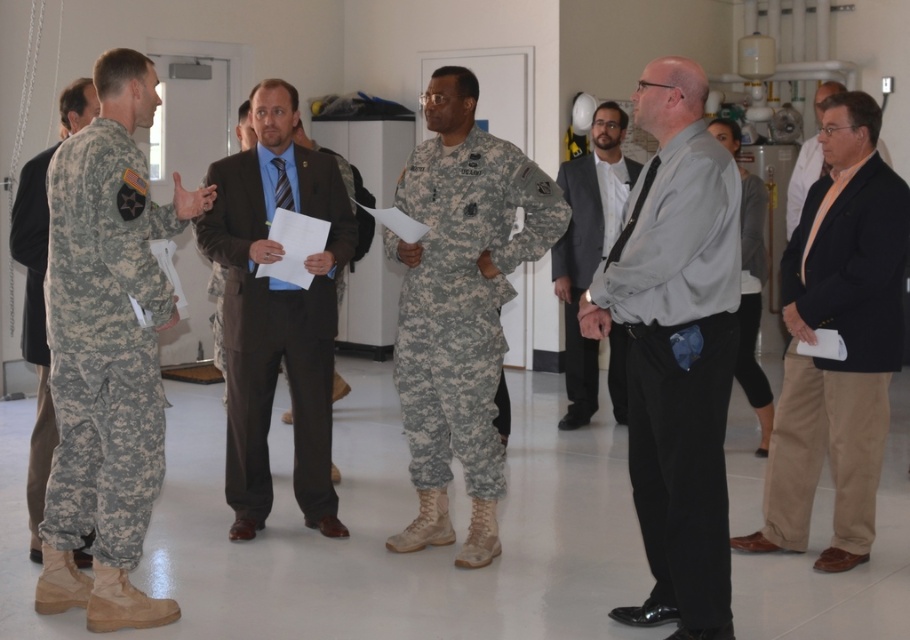
In the scene shown: You are planning to take a photo of the camouflage fabric uniform at center and the white matte shirt at center. Which one should you zoom in on to capture more details without moving the camera?

The camouflage fabric uniform at center has a larger width than the white matte shirt at center, so zooming in on the camouflage fabric uniform at center will allow you to capture more details without moving the camera since it occupies more space in the frame.

What is located at the coordinates point [104,342] in the image?

The camouflage fabric uniform at left is located at point [104,342].